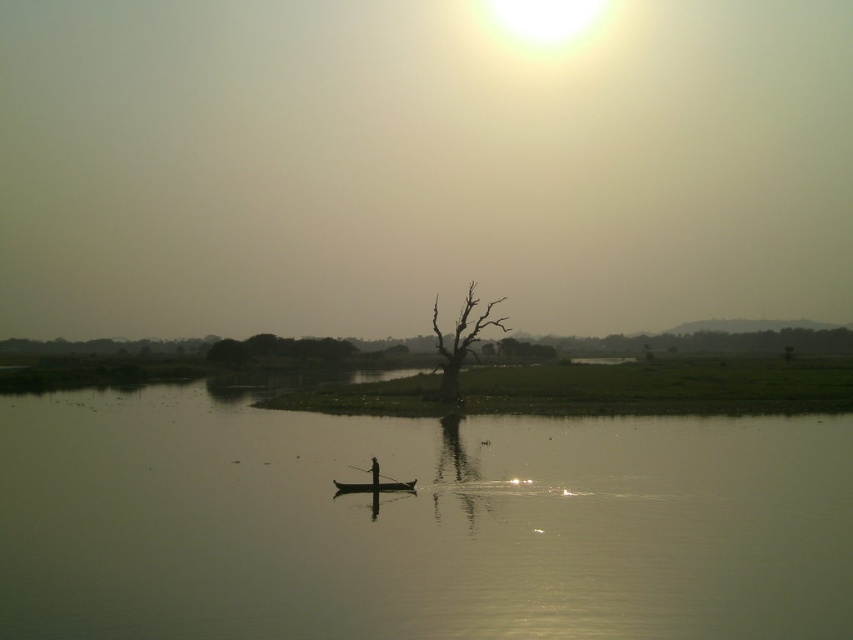
You are a tourist standing on the lakeshore observing the scene. You notice the black wood paddle at center and the silhouette wood person at center. Which object is closer to the water surface?

The black wood paddle at center is positioned under the silhouette wood person at center, so it is closer to the water surface.

You are standing on the shore observing the scene. Which object is closer to you between the black wood paddle at center and the silhouette wood person at center?

The black wood paddle at center is closer to the viewer than the silhouette wood person at center.

You are standing on the shore of the lake and see the brown textured tree at center and the silhouette wood person at center. Which object is closer to you?

The brown textured tree at center is closer to you because it is positioned further to the viewer than the silhouette wood person at center.